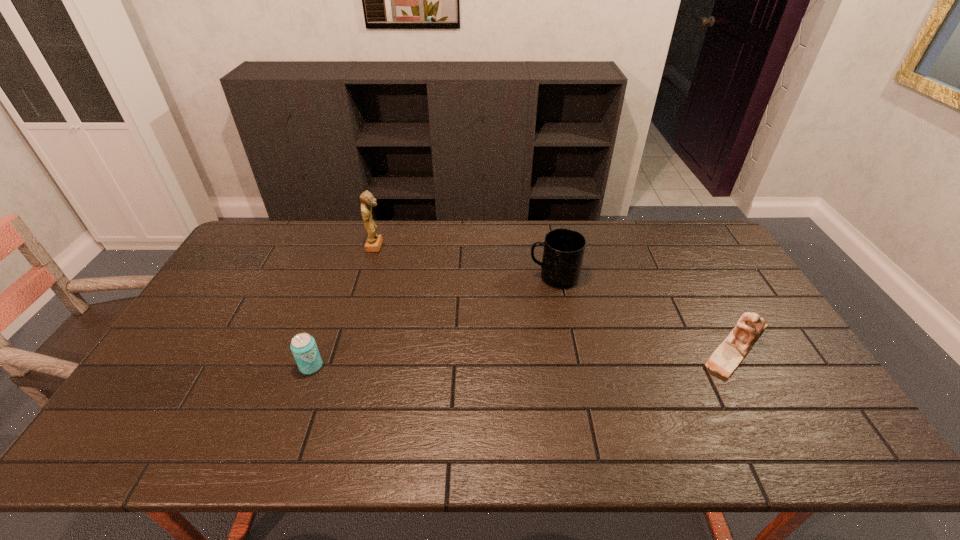
This screenshot has height=540, width=960. I want to click on vacant point at the left edge, so click(186, 327).

In the image, there is a desktop. At what (x,y) coordinates should I click in order to perform the action: click on vacant space at the right edge. Please return your answer as a coordinate pair (x, y). The image size is (960, 540). Looking at the image, I should click on (750, 288).

Find the location of a particular element. The image size is (960, 540). unoccupied position between the leftmost object and the nearer figurine is located at coordinates (523, 357).

Locate an element on the screen. This screenshot has width=960, height=540. free point between the second object from left to right and the second object from right to left is located at coordinates (465, 261).

Where is `free spot between the leftmost object and the tallest object`? free spot between the leftmost object and the tallest object is located at coordinates (344, 306).

What are the coordinates of `vacant space in between the shorter figurine and the third object from right to left` in the screenshot? It's located at (556, 298).

Identify the location of empty space that is in between the beer can and the taller figurine. (344, 306).

At what (x,y) coordinates should I click in order to perform the action: click on vacant space in between the shortest object and the second shortest object. Please return your answer as a coordinate pair (x, y). Looking at the image, I should click on (523, 357).

Locate an element on the screen. The width and height of the screenshot is (960, 540). vacant space in between the leftmost object and the shorter figurine is located at coordinates (523, 357).

Identify the location of vacant area between the beer can and the shorter figurine. The width and height of the screenshot is (960, 540). (523, 357).